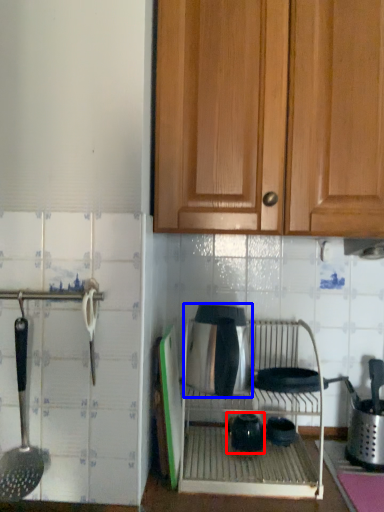
Question: Which object appears farthest to the camera in this image, tea pot (highlighted by a red box) or appliance (highlighted by a blue box)?

Choices:
 (A) tea pot
 (B) appliance

Answer: (A)